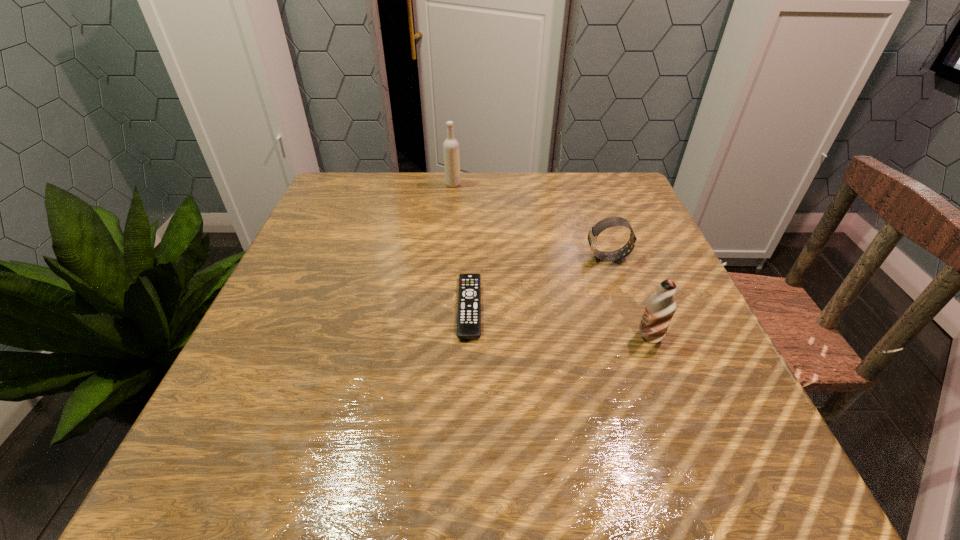
Where is `free space located on the face of the third tallest object`? The width and height of the screenshot is (960, 540). free space located on the face of the third tallest object is located at coordinates (430, 258).

Locate an element on the screen. vacant space located on the face of the third tallest object is located at coordinates (504, 258).

The image size is (960, 540). I want to click on vacant space located on the left of the remote control, so click(x=265, y=308).

Find the location of `object at the far edge`. object at the far edge is located at coordinates [450, 146].

In order to click on chocolate milk that is at the right edge in this screenshot , I will do `click(660, 307)`.

Locate an element on the screen. This screenshot has width=960, height=540. watch that is at the right edge is located at coordinates (606, 223).

Where is `free space at the far edge`? The width and height of the screenshot is (960, 540). free space at the far edge is located at coordinates (539, 172).

The height and width of the screenshot is (540, 960). I want to click on blank area at the near edge, so click(x=418, y=460).

Locate an element on the screen. The width and height of the screenshot is (960, 540). vacant position at the left edge of the desktop is located at coordinates (242, 386).

The width and height of the screenshot is (960, 540). In order to click on vacant space at the right edge in this screenshot , I will do `click(741, 433)`.